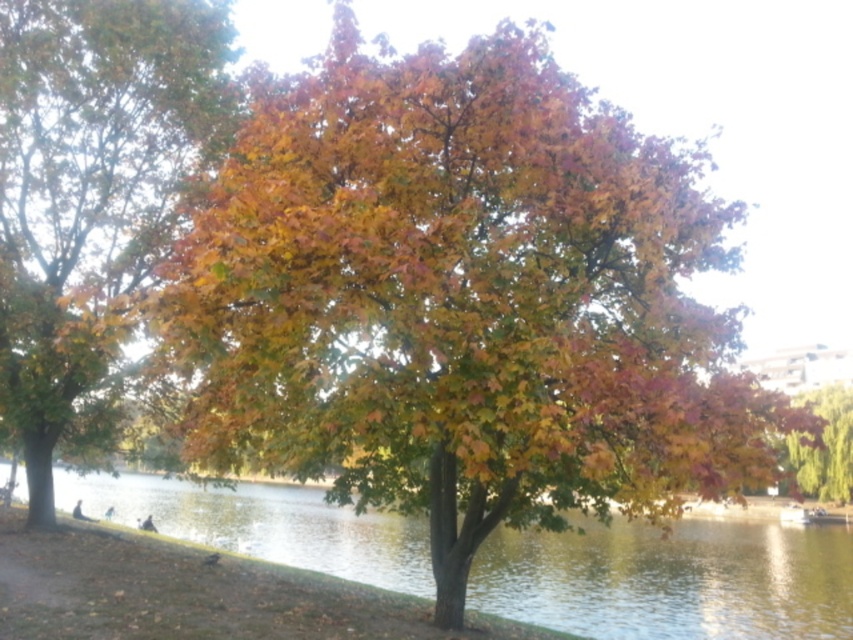
You are standing by the lakeside and want to throw a small pebble into the water. The multicolored leaves at center are blocking part of the water surface. Can you estimate whether the visible clear water at center is wider than the leaves?

The multicolored leaves at center have a width less than the clear water at center, so yes, the visible clear water at center is wider than the leaves.

You are standing on the lakeside path and see the multicolored leaves at center and the autumn leaves tree at right. Which object is closer to your left side?

The multicolored leaves at center is closer to your left side since it is positioned to the left of the autumn leaves tree at right.